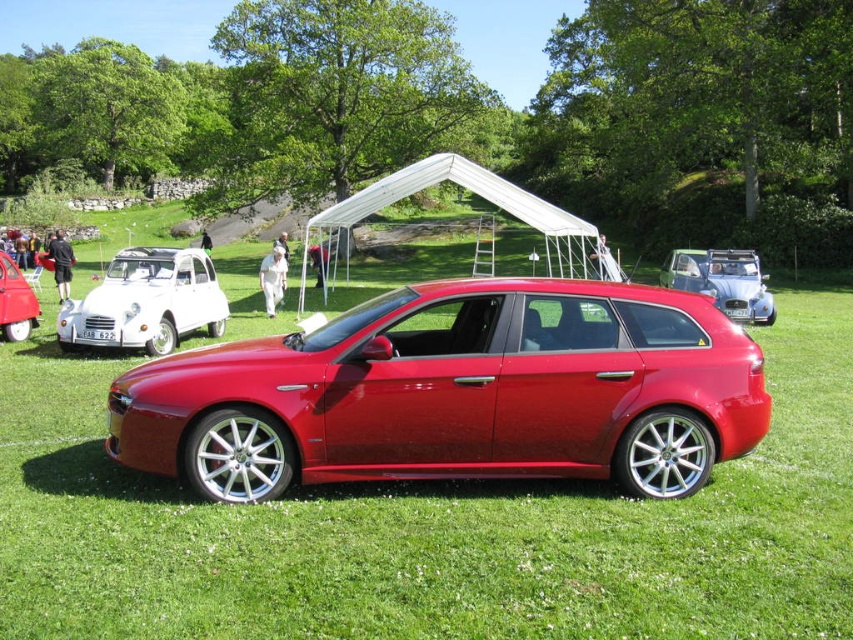
You are standing in the grassy field at the car show and want to take a photo of the glossy metallic car at center. If your camera has a maximum focus range of 5 meters, will you be able to capture the car clearly?

The glossy metallic car at center is 5.24 meters away from the viewer. Since the camera can only focus up to 5 meters, it won t be able to capture the car clearly at this distance.

You are a photographer at the car show and want to take a photo of the glossy metallic car at center and the white cloth at center together in the frame. The camera you have can capture objects within a 10 meter range. Can you include both objects in a single photo without moving the camera?

The glossy metallic car at center is 12.30 meters away from the white cloth at center. Since the camera can only capture objects within 10 meters, the distance between them exceeds the camera range. Therefore, you cannot include both objects in a single photo without moving the camera.